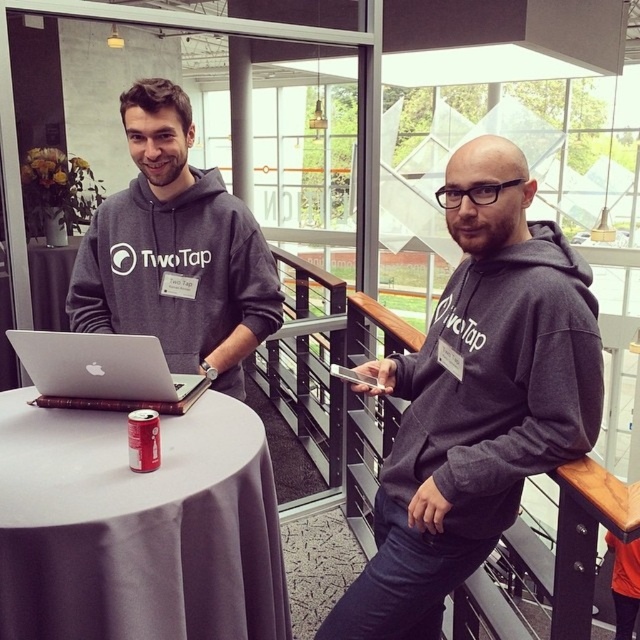
Question: Where is dark gray hoodie at center located in relation to silver metallic laptop at center in the image?

Choices:
 (A) left
 (B) right

Answer: (B)

Question: Which object is farther from the camera taking this photo?

Choices:
 (A) dark gray hoodie at center
 (B) red matte can at table left
 (C) silver metallic laptop at center

Answer: (C)

Question: Which object is positioned farthest from the matte gray hoodie at center?

Choices:
 (A) red matte can at table left
 (B) dark gray hoodie at center
 (C) silver metallic laptop at center
 (D) white satin round table at center

Answer: (B)

Question: Based on their relative distances, which object is farther from the silver metallic laptop at center?

Choices:
 (A) matte gray hoodie at center
 (B) dark gray hoodie at center
 (C) white satin round table at center
 (D) red matte can at table left

Answer: (B)

Question: Can you confirm if silver metallic laptop at center is wider than red matte can at table left?

Choices:
 (A) yes
 (B) no

Answer: (A)

Question: Can you confirm if white satin round table at center is wider than silver metallic laptop at center?

Choices:
 (A) no
 (B) yes

Answer: (B)